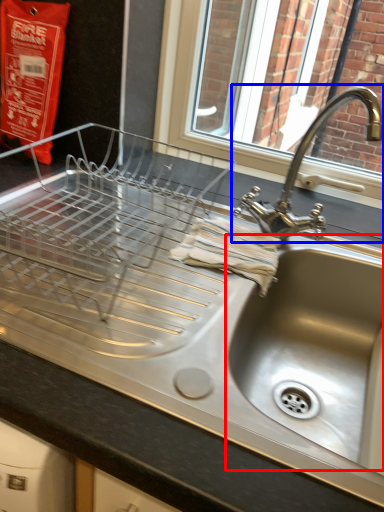
Question: Which object is further to the camera taking this photo, sink (highlighted by a red box) or tap (highlighted by a blue box)?

Choices:
 (A) sink
 (B) tap

Answer: (B)